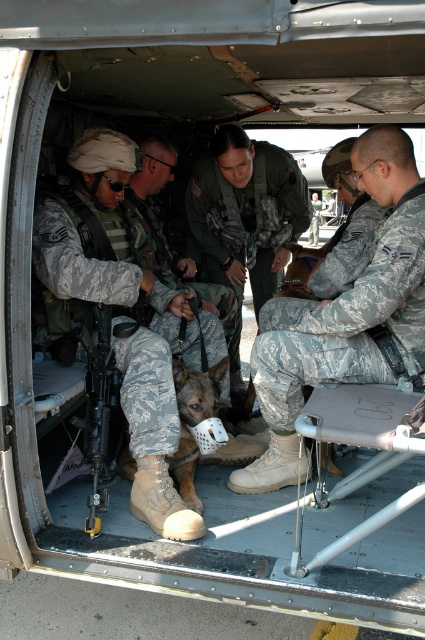
Question: Which point is closer to the camera?

Choices:
 (A) (380, 349)
 (B) (308, 262)

Answer: (A)

Question: Among these objects, which one is farthest from the camera?

Choices:
 (A) camouflage fabric dog at center
 (B) camouflage fabric uniform at center
 (C) dark brown fur at center

Answer: (C)

Question: Does camouflage fabric dog at center have a greater width compared to dark brown fur at center?

Choices:
 (A) no
 (B) yes

Answer: (B)

Question: From the image, what is the correct spatial relationship of camouflage uniform at center in relation to dark brown fur at center?

Choices:
 (A) left
 (B) right

Answer: (A)

Question: Which object is positioned closest to the dark brown fur at center?

Choices:
 (A) camouflage fabric uniform at center
 (B) camouflage fabric dog at center

Answer: (A)

Question: Can you confirm if camouflage fabric uniform at center is positioned to the left of camouflage uniform at center?

Choices:
 (A) no
 (B) yes

Answer: (A)